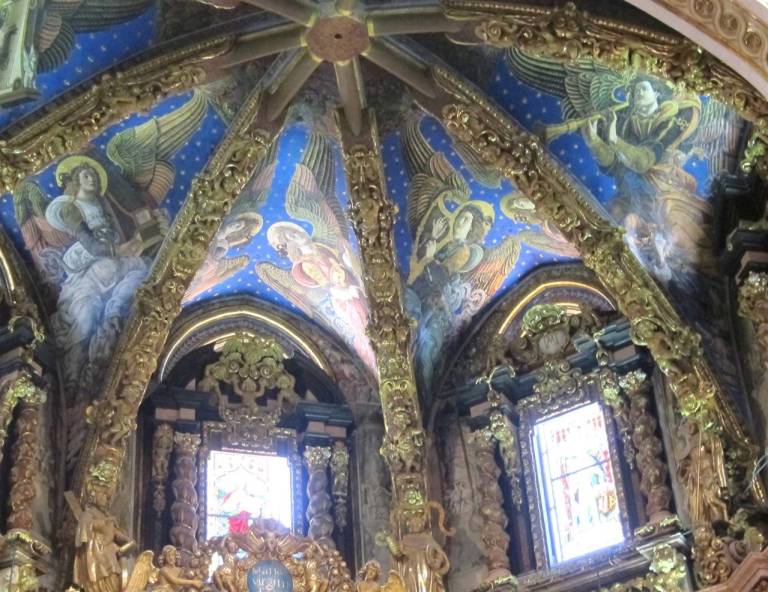
Locate an element on the screen. The height and width of the screenshot is (592, 768). paitning is located at coordinates (429, 182).